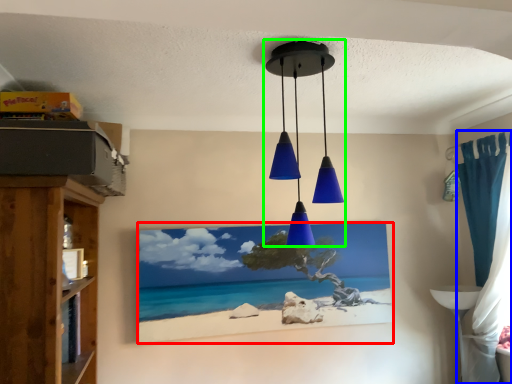
Question: Estimate the real-world distances between objects in this image. Which object is closer to picture frame (highlighted by a red box), curtain (highlighted by a blue box) or lamp (highlighted by a green box)?

Choices:
 (A) curtain
 (B) lamp

Answer: (B)